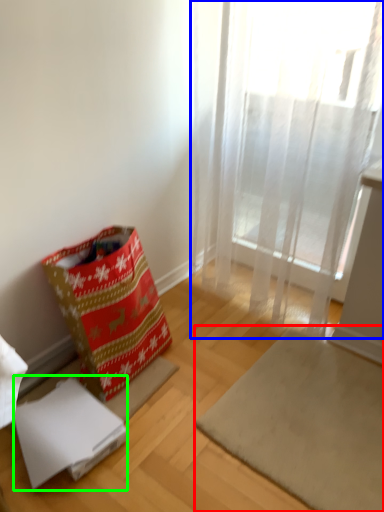
Question: Considering the real-world distances, which object is farthest from mat (highlighted by a red box)? curtain (highlighted by a blue box) or cardboard box (highlighted by a green box)?

Choices:
 (A) curtain
 (B) cardboard box

Answer: (A)